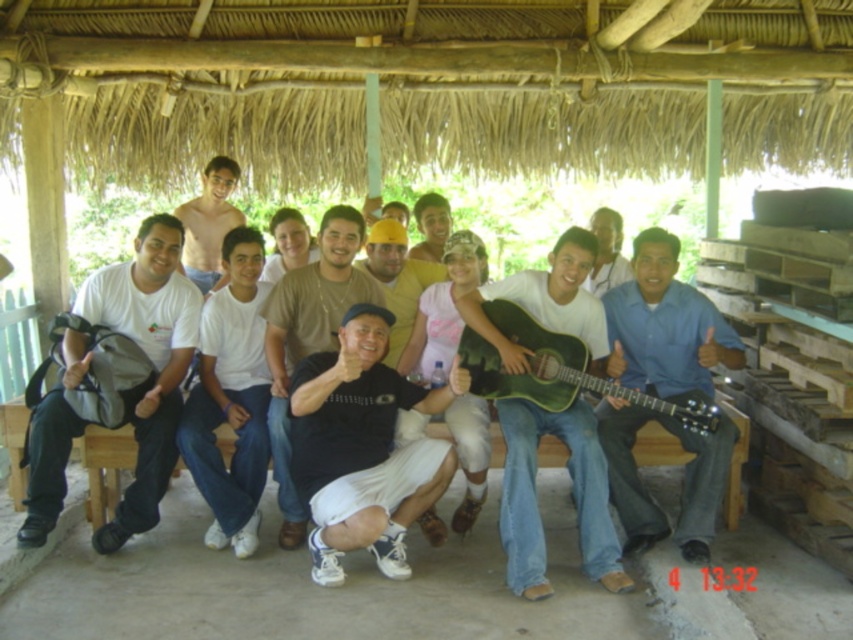
Question: Considering the real-world distances, which object is farthest from the white matte backpack at left?

Choices:
 (A) light brown wooden guitar at center
 (B) green acoustic guitar at center
 (C) black cotton shirt at center

Answer: (A)

Question: From the image, what is the correct spatial relationship of black matte shirt at center in relation to light brown wooden guitar at center?

Choices:
 (A) below
 (B) above

Answer: (A)

Question: Can you confirm if white cotton shirt at center is smaller than light brown wooden guitar at center?

Choices:
 (A) yes
 (B) no

Answer: (B)

Question: Which point is farther to the camera?

Choices:
 (A) (616, 330)
 (B) (431, 276)
 (C) (328, 394)

Answer: (B)

Question: Is black matte shirt at center to the right of green matte guitar at center from the viewer's perspective?

Choices:
 (A) no
 (B) yes

Answer: (A)

Question: Among these objects, which one is farthest from the camera?

Choices:
 (A) white cotton shirt at center
 (B) light brown wooden guitar at center
 (C) black matte shirt at center

Answer: (B)